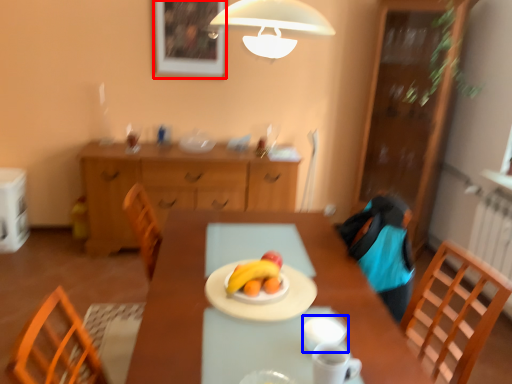
Question: Which object is further to the camera taking this photo, picture frame (highlighted by a red box) or tableware (highlighted by a blue box)?

Choices:
 (A) picture frame
 (B) tableware

Answer: (A)